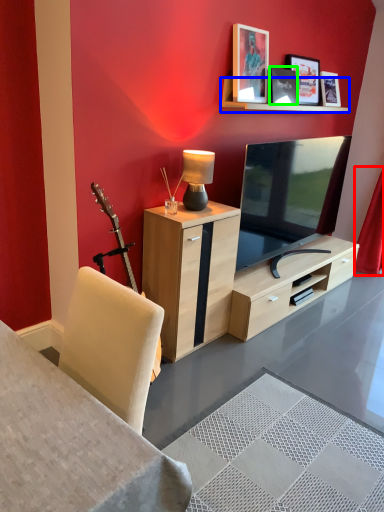
Question: Which is farther away from curtain (highlighted by a red box)? shelf (highlighted by a blue box) or picture frame (highlighted by a green box)?

Choices:
 (A) shelf
 (B) picture frame

Answer: (B)